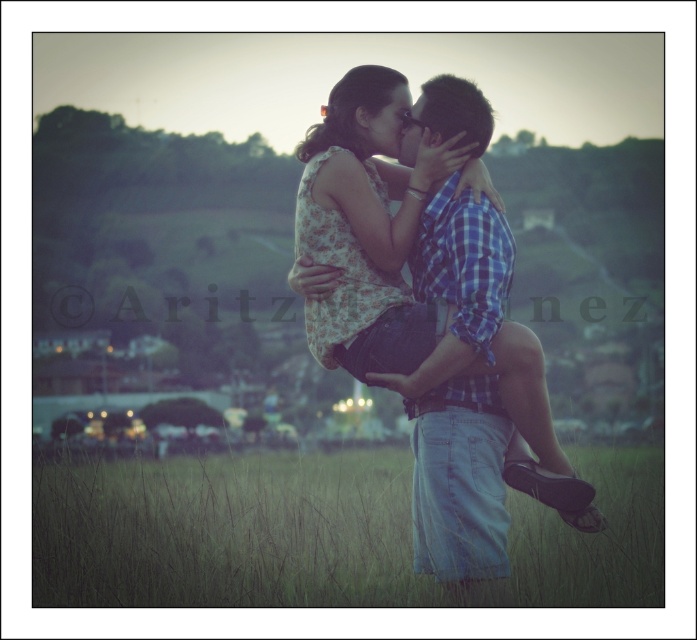
Is floral fabric dress at center thinner than blue plaid shirt at center?

In fact, floral fabric dress at center might be wider than blue plaid shirt at center.

Can you confirm if floral fabric dress at center is bigger than blue plaid shirt at center?

Indeed, floral fabric dress at center has a larger size compared to blue plaid shirt at center.

The image size is (697, 640). I want to click on floral fabric dress at center, so click(x=381, y=218).

Between point (72, 538) and point (436, 445), which one is positioned in front?

Point (436, 445) is in front.

Which is below, green grass at lower center or blue plaid shirt at center?

green grass at lower center is below.

Is point (213, 541) closer to viewer compared to point (487, 449)?

That is False.

You are a GUI agent. You are given a task and a screenshot of the screen. Output one action in this format:
    pyautogui.click(x=<x>, y=<y>)
    Task: Click on the green grass at lower center
    
    Given the screenshot: What is the action you would take?
    pyautogui.click(x=319, y=532)

In the scene shown: Between green grass at lower center and floral fabric dress at center, which one is positioned higher?

Positioned higher is floral fabric dress at center.

Is green grass at lower center positioned behind floral fabric dress at center?

No, it is in front of floral fabric dress at center.

Which is in front, point (204, 582) or point (424, 472)?

Point (204, 582) is in front.

Identify the location of green grass at lower center. The width and height of the screenshot is (697, 640). (319, 532).